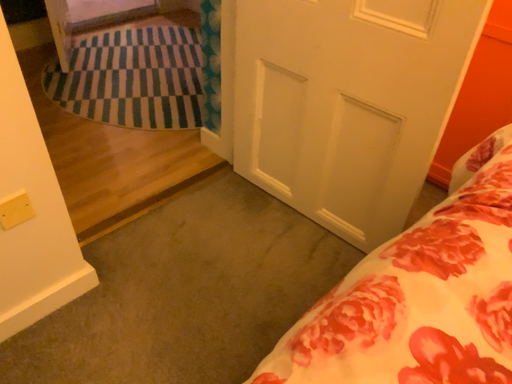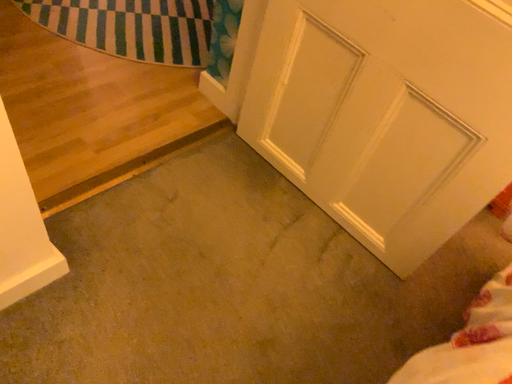
Question: How did the camera likely rotate when shooting the video?

Choices:
 (A) rotated downward
 (B) rotated upward

Answer: (A)